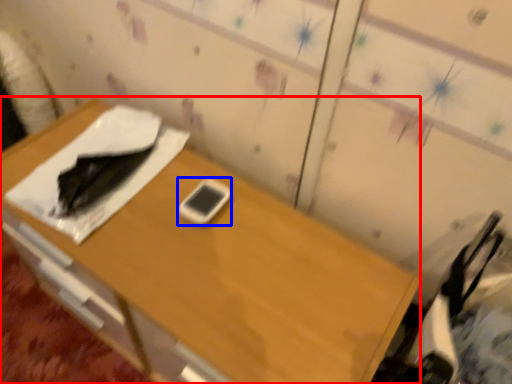
Question: Which of the following is the closest to the observer, desk (highlighted by a red box) or mobile phone (highlighted by a blue box)?

Choices:
 (A) desk
 (B) mobile phone

Answer: (A)